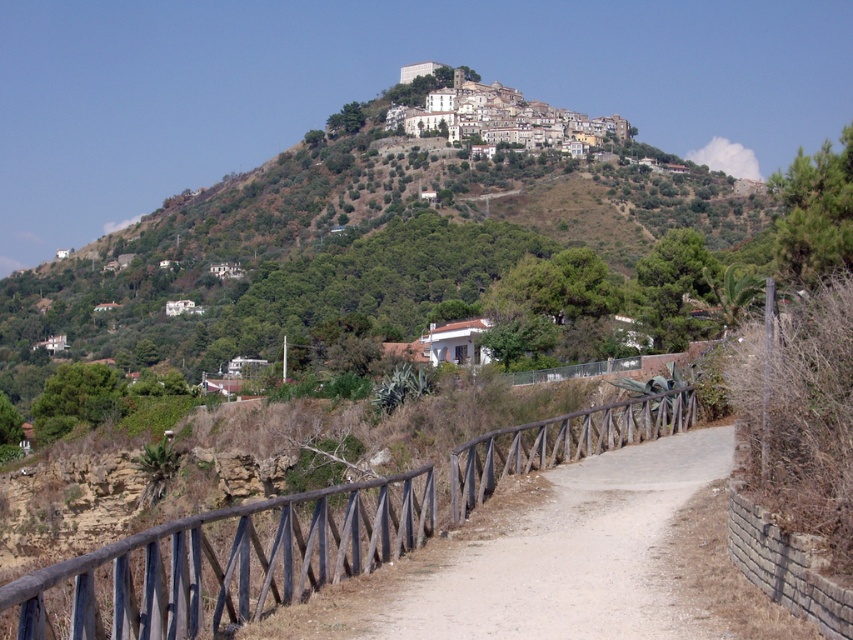
Question: Which point appears closest to the camera in this image?

Choices:
 (A) 502,486
 (B) 306,577

Answer: (B)

Question: Can you confirm if brown wooden rail at center is positioned below dirt path at center?

Choices:
 (A) yes
 (B) no

Answer: (B)

Question: Which of the following is the farthest from the observer?

Choices:
 (A) (123, 541)
 (B) (596, 630)

Answer: (B)

Question: Does brown wooden rail at center appear on the left side of dirt path at center?

Choices:
 (A) yes
 (B) no

Answer: (A)

Question: Can you confirm if brown wooden rail at center is smaller than dirt path at center?

Choices:
 (A) no
 (B) yes

Answer: (A)

Question: Which point is closer to the camera?

Choices:
 (A) (337, 516)
 (B) (715, 621)

Answer: (B)